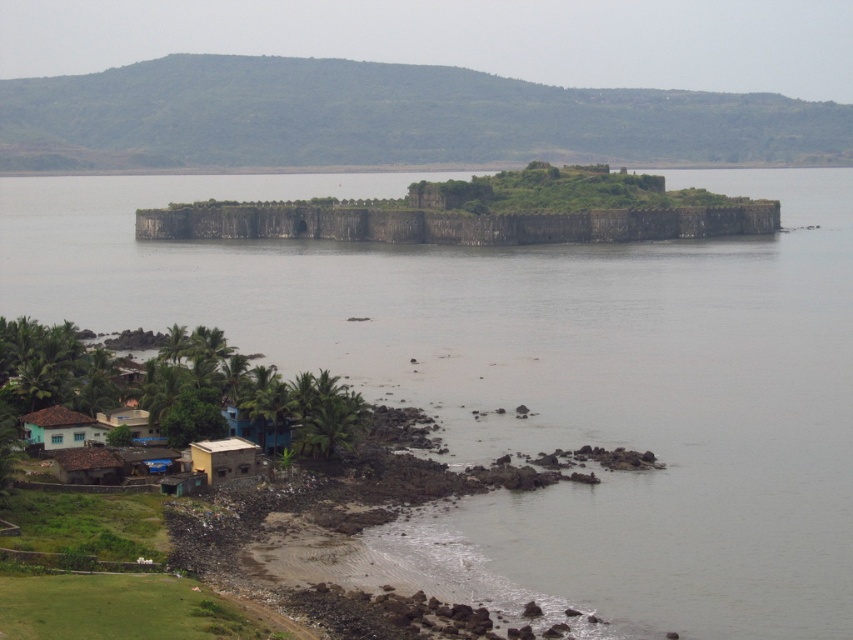
You are standing on the rocky shoreline and want to reach the island fortress in the middle of the gray water at center. Can you directly walk to the fortress from your current position without getting wet?

The gray water at center is located at point 0.628, so you would need to wade through the water to reach the fortress. However, the exact distance isn

You are a tourist standing at the brown corrugated roof hut at lower left and want to reach the gray water at center. Can you walk directly to the water without crossing any obstacles?

The distance between the brown corrugated roof hut at lower left and the gray water at center is 254.19 meters. However, the scene description mentions a rocky shoreline and a cluster of small houses between them. Therefore, you would need to navigate around these obstacles to reach the water.

You are a delivery drone that needs to fly from the yellow matte hut at lower left to the blue corrugated metal hut at lower center. The drone has a wingspan of 1.2 meters. Is there enough space between these two huts for the drone to pass through?

The yellow matte hut at lower left might be wider than blue corrugated metal hut at lower center, but the distance between them isn not specified in the provided description. Without information about the spacing between the huts, it is impossible to determine if the drone can safely pass through with its 1.2 meter wingspan.